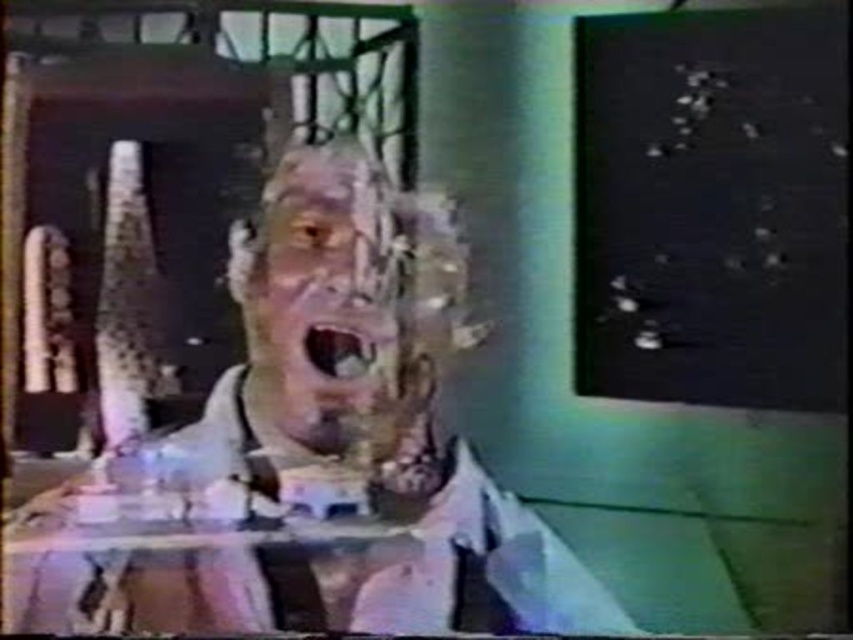
Question: Does matte textured face at center appear on the right side of matte plastic mouth at center?

Choices:
 (A) yes
 (B) no

Answer: (B)

Question: Which point appears closest to the camera in this image?

Choices:
 (A) (267, 305)
 (B) (552, 589)
 (C) (312, 362)

Answer: (B)

Question: Which point is farther from the camera taking this photo?

Choices:
 (A) (399, 464)
 (B) (320, 349)
 (C) (358, 164)

Answer: (B)

Question: Considering the relative positions of matte textured face at center and matte plastic mouth at center in the image provided, where is matte textured face at center located with respect to matte plastic mouth at center?

Choices:
 (A) right
 (B) left

Answer: (B)

Question: Does matte textured face at center appear on the left side of matte plastic mouth at center?

Choices:
 (A) no
 (B) yes

Answer: (B)

Question: Among these objects, which one is farthest from the camera?

Choices:
 (A) matte textured face at center
 (B) matte plastic mannequin head at center

Answer: (A)